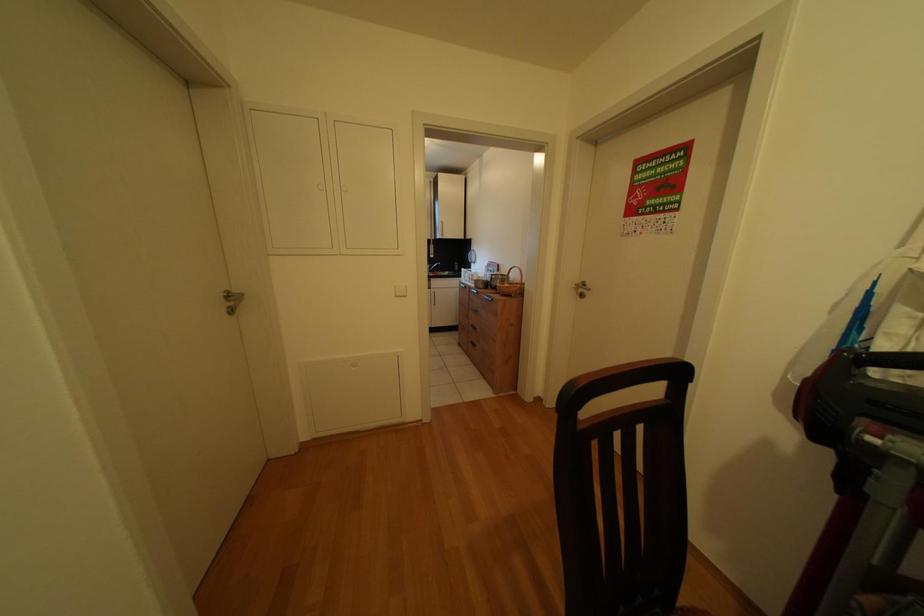
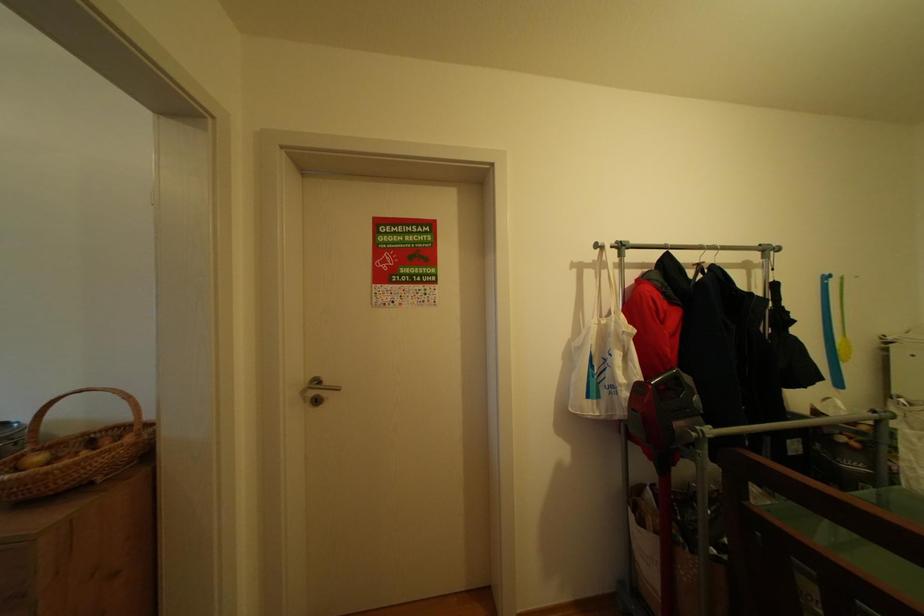
Question: How did the camera likely rotate?

Choices:
 (A) Left
 (B) Right
 (C) Up
 (D) Down

Answer: (B)